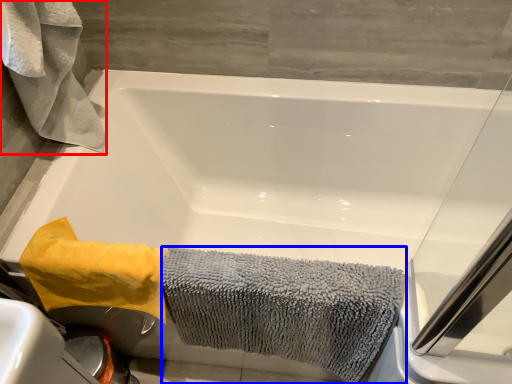
Question: Which object appears farthest to the camera in this image, bath towel (highlighted by a red box) or bath towel (highlighted by a blue box)?

Choices:
 (A) bath towel
 (B) bath towel

Answer: (B)